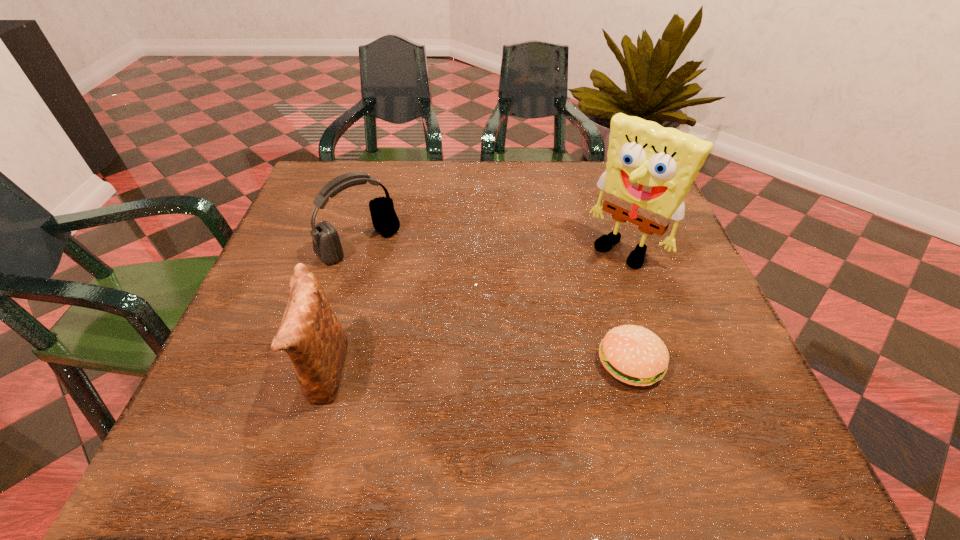
Locate an element on the screen. The width and height of the screenshot is (960, 540). clutch bag is located at coordinates (310, 333).

Locate an element on the screen. the shortest object is located at coordinates (632, 354).

Locate an element on the screen. The width and height of the screenshot is (960, 540). the tallest object is located at coordinates point(649,171).

Where is `headset`? headset is located at coordinates (326, 243).

You are a GUI agent. You are given a task and a screenshot of the screen. Output one action in this format:
    pyautogui.click(x=<x>, y=<y>)
    Task: Click on the vacant space positioned 0.350m on the back of the shortest object
    
    Given the screenshot: What is the action you would take?
    pyautogui.click(x=590, y=221)

Locate an element on the screen. This screenshot has height=540, width=960. vacant space located on the face of the tallest object is located at coordinates (515, 359).

Where is `free space located 0.280m on the face of the tallest object`? free space located 0.280m on the face of the tallest object is located at coordinates (531, 342).

Locate an element on the screen. The width and height of the screenshot is (960, 540). vacant area situated on the face of the tallest object is located at coordinates (578, 295).

Locate an element on the screen. The height and width of the screenshot is (540, 960). free space located on the headband of the headset is located at coordinates (488, 367).

The width and height of the screenshot is (960, 540). In order to click on vacant space situated on the headband of the headset in this screenshot , I will do `click(398, 279)`.